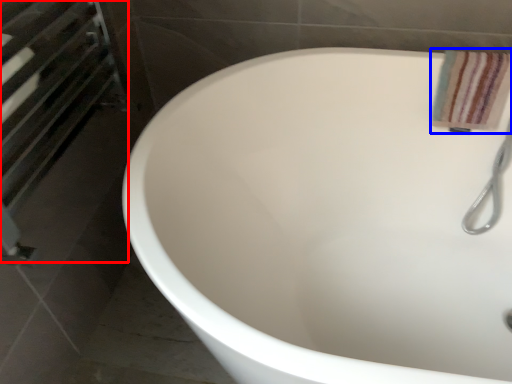
Question: Which object appears farthest to the camera in this image, screen door (highlighted by a red box) or bath towel (highlighted by a blue box)?

Choices:
 (A) screen door
 (B) bath towel

Answer: (B)